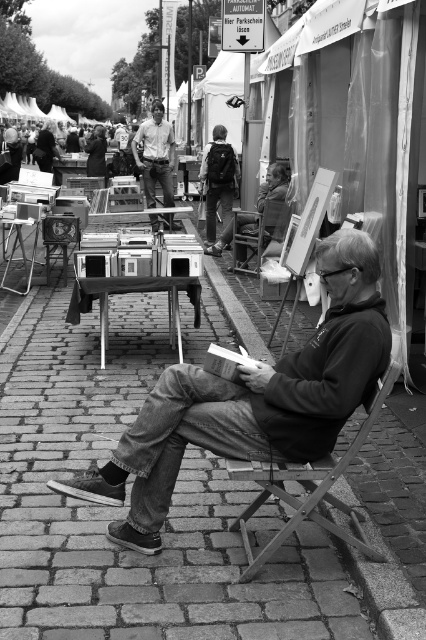
Question: In this image, where is denim jeans at center located relative to matte khaki pants at center?

Choices:
 (A) left
 (B) right

Answer: (B)

Question: Which point is farther from the camera taking this photo?

Choices:
 (A) (149, 125)
 (B) (287, 477)
 (C) (242, 221)
 (D) (291, 422)

Answer: (A)

Question: Among these points, which one is farthest from the camera?

Choices:
 (A) (143, 168)
 (B) (244, 250)
 (C) (253, 449)

Answer: (A)

Question: Can you confirm if matte khaki pants at center is wider than wooden chair at center?

Choices:
 (A) no
 (B) yes

Answer: (B)

Question: Among these objects, which one is nearest to the camera?

Choices:
 (A) metallic gray chair at center
 (B) matte khaki pants at center
 (C) wooden chair at center
 (D) denim jeans at center

Answer: (A)

Question: Does denim jeans at center appear on the left side of wooden chair at center?

Choices:
 (A) yes
 (B) no

Answer: (A)